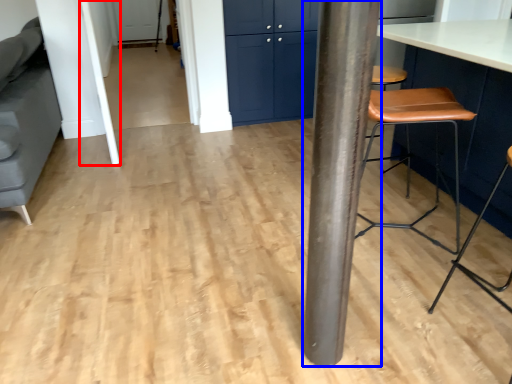
Question: Among these objects, which one is farthest to the camera, beam (highlighted by a red box) or pillar (highlighted by a blue box)?

Choices:
 (A) beam
 (B) pillar

Answer: (A)